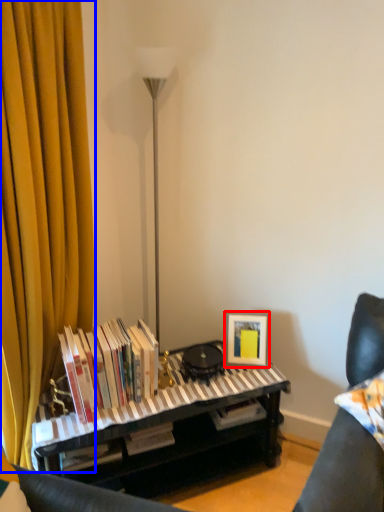
Question: Among these objects, which one is nearest to the camera, picture frame (highlighted by a red box) or curtain (highlighted by a blue box)?

Choices:
 (A) picture frame
 (B) curtain

Answer: (B)